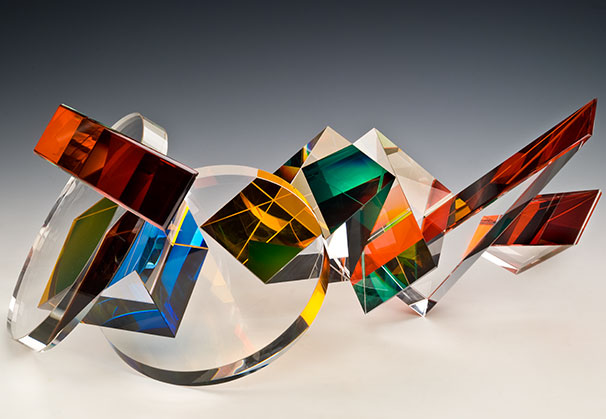
Locate an element on the screen. wall is located at coordinates (245, 106).